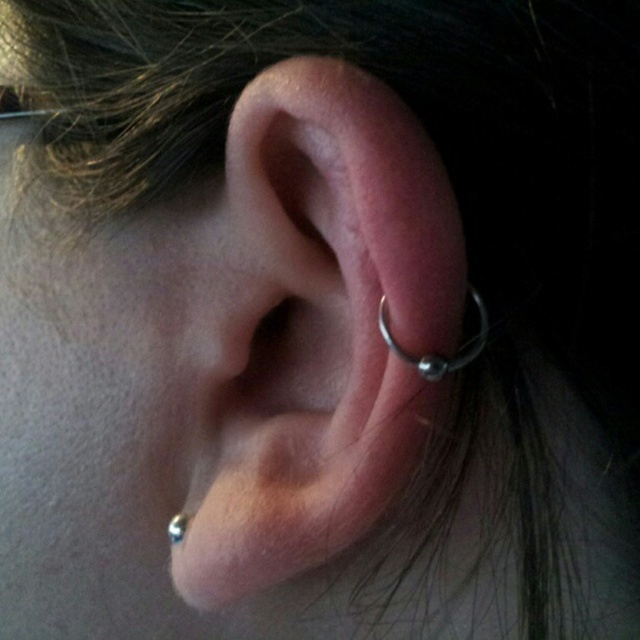
You are a jeweler examining a customer who wants to add another piercing. They show you their ear with the silver metallic hoop at center and the silver metallic ring at ear. Which piercing is positioned higher up on the earlobe?

The silver metallic hoop at center is positioned higher up on the earlobe than the silver metallic ring at ear.

You are a jeweler measuring the distance between two piercings on a customer. The customer has a silver metallic hoop at center and a silver metallic ring at ear. Can you fit a chain connecting them if your chain is 4 inches long?

The silver metallic hoop at center is 4.43 inches away from silver metallic ring at ear. The chain is only 4 inches long, so it is too short to connect them.